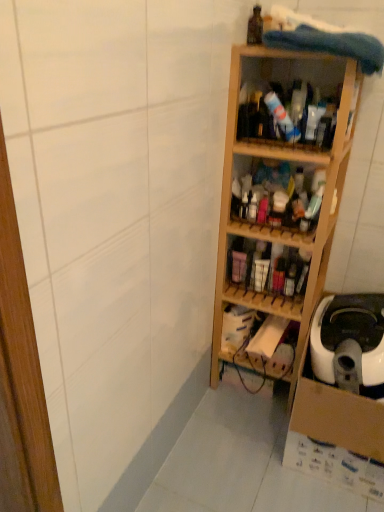
Question: Would you say light wood shelf at center, the third shelf viewed from the top, is to the left or to the right of wooden shelves at center, the second shelf viewed from the top, in the picture?

Choices:
 (A) right
 (B) left

Answer: (A)

Question: Does point (264, 316) appear closer or farther from the camera than point (281, 195)?

Choices:
 (A) closer
 (B) farther

Answer: (B)

Question: Estimate the real-world distances between objects in this image. Which object is farther from the wooden shelves at center, the fourth shelf positioned from the top?

Choices:
 (A) wooden shelves at center, acting as the fourth shelf starting from the bottom
 (B) wooden shelf at center, marked as the 1th shelf in a bottom-to-top arrangement
 (C) wooden shelf at center, the fifth shelf positioned from the bottom
 (D) light wood shelf at center, the third shelf viewed from the top

Answer: (C)

Question: Which object is positioned farthest from the wooden shelf at center, marked as the 1th shelf in a bottom-to-top arrangement?

Choices:
 (A) wooden shelf at center, the fifth shelf positioned from the bottom
 (B) wooden shelves at center, which ranks as the 2th shelf in bottom-to-top order
 (C) light wood shelf at center, the third shelf viewed from the top
 (D) wooden shelves at center, acting as the fourth shelf starting from the bottom

Answer: (A)